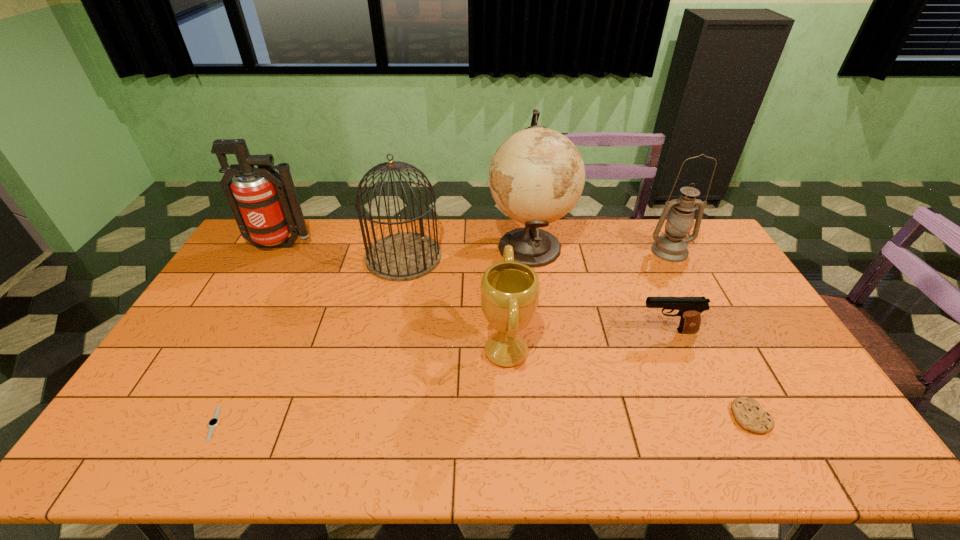
The height and width of the screenshot is (540, 960). In order to click on free spot located on the left of the second shortest object in this screenshot , I will do (571, 417).

Where is `vacant region located 0.330m on the right of the shortest object`? The image size is (960, 540). vacant region located 0.330m on the right of the shortest object is located at coordinates pos(353,423).

Find the location of a particular element. globe that is at the far edge is located at coordinates (537, 175).

You are a GUI agent. You are given a task and a screenshot of the screen. Output one action in this format:
    pyautogui.click(x=<x>, y=<y>)
    Task: Click on the fire extinguisher that is positioned at the far edge
    
    Given the screenshot: What is the action you would take?
    pyautogui.click(x=268, y=211)

You are a GUI agent. You are given a task and a screenshot of the screen. Output one action in this format:
    pyautogui.click(x=<x>, y=<y>)
    Task: Click on the birdcage that is at the far edge
    This screenshot has width=960, height=540.
    Given the screenshot: What is the action you would take?
    pyautogui.click(x=406, y=256)

Where is `oil lamp that is at the far edge`? Image resolution: width=960 pixels, height=540 pixels. oil lamp that is at the far edge is located at coordinates (672, 246).

You are a GUI agent. You are given a task and a screenshot of the screen. Output one action in this format:
    pyautogui.click(x=<x>, y=<y>)
    Task: Click on the cookie that is at the near edge
    The width and height of the screenshot is (960, 540).
    Given the screenshot: What is the action you would take?
    pyautogui.click(x=749, y=414)

At what (x,y) coordinates should I click in order to perform the action: click on watch situated at the near edge. Please return your answer as a coordinate pair (x, y). The height and width of the screenshot is (540, 960). Looking at the image, I should click on (214, 421).

I want to click on object located in the left edge section of the desktop, so point(268,211).

Locate an element on the screen. oil lamp that is at the right edge is located at coordinates (672, 246).